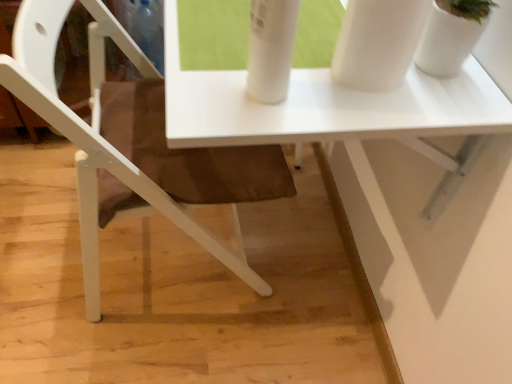
You are a GUI agent. You are given a task and a screenshot of the screen. Output one action in this format:
    pyautogui.click(x=<x>, y=<y>)
    Task: Click on the free spot in front of white matte chair at lower left
    
    Given the screenshot: What is the action you would take?
    pyautogui.click(x=152, y=347)